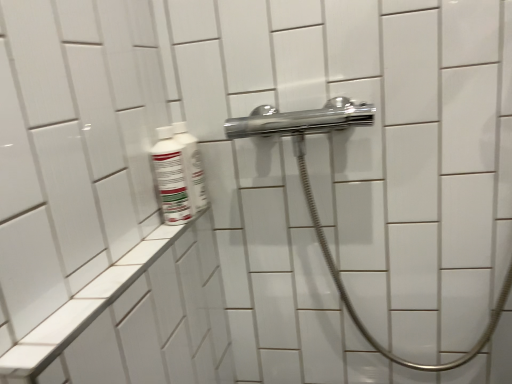
Question: Is white glossy bottle at left, placed as the first mouthwash when sorted from front to back, far away from white ceramic ledge at lower left?

Choices:
 (A) yes
 (B) no

Answer: (B)

Question: Is white glossy bottle at left, the second mouthwash positioned from the back, smaller than white ceramic ledge at lower left?

Choices:
 (A) yes
 (B) no

Answer: (A)

Question: Is white ceramic ledge at lower left a part of white glossy bottle at left, the second mouthwash positioned from the back?

Choices:
 (A) no
 (B) yes

Answer: (A)

Question: Is white glossy bottle at left, the second mouthwash positioned from the back, further to the viewer compared to white ceramic ledge at lower left?

Choices:
 (A) yes
 (B) no

Answer: (A)

Question: Is white glossy bottle at left, the second mouthwash positioned from the back, positioned in front of white ceramic ledge at lower left?

Choices:
 (A) yes
 (B) no

Answer: (B)

Question: From the image's perspective, does white glossy bottle at left, the second mouthwash positioned from the back, appear higher than white ceramic ledge at lower left?

Choices:
 (A) yes
 (B) no

Answer: (A)

Question: Considering the relative positions of white glossy bottle at upper left, which is the 2th mouthwash in front-to-back order, and white ceramic ledge at lower left in the image provided, is white glossy bottle at upper left, which is the 2th mouthwash in front-to-back order, to the right of white ceramic ledge at lower left from the viewer's perspective?

Choices:
 (A) no
 (B) yes

Answer: (B)

Question: Is white glossy bottle at upper left, acting as the 1th mouthwash starting from the back, directly adjacent to white ceramic ledge at lower left?

Choices:
 (A) yes
 (B) no

Answer: (B)

Question: Can you confirm if white glossy bottle at upper left, acting as the 1th mouthwash starting from the back, is positioned to the left of white ceramic ledge at lower left?

Choices:
 (A) yes
 (B) no

Answer: (B)

Question: Is white glossy bottle at upper left, acting as the 1th mouthwash starting from the back, smaller than white ceramic ledge at lower left?

Choices:
 (A) yes
 (B) no

Answer: (A)

Question: From a real-world perspective, does white glossy bottle at upper left, acting as the 1th mouthwash starting from the back, sit lower than white ceramic ledge at lower left?

Choices:
 (A) no
 (B) yes

Answer: (A)

Question: From the image's perspective, does white glossy bottle at upper left, acting as the 1th mouthwash starting from the back, appear lower than white ceramic ledge at lower left?

Choices:
 (A) no
 (B) yes

Answer: (A)

Question: Is white glossy bottle at left, placed as the first mouthwash when sorted from front to back, positioned far away from white glossy bottle at upper left, acting as the 1th mouthwash starting from the back?

Choices:
 (A) no
 (B) yes

Answer: (A)